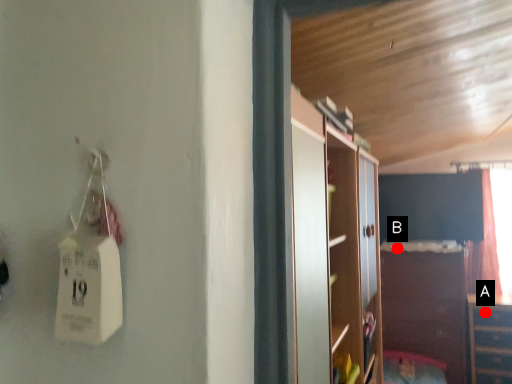
Question: Two points are circled on the image, labeled by A and B beside each circle. Which point is closer to the camera taking this photo?

Choices:
 (A) A is closer
 (B) B is closer

Answer: (A)